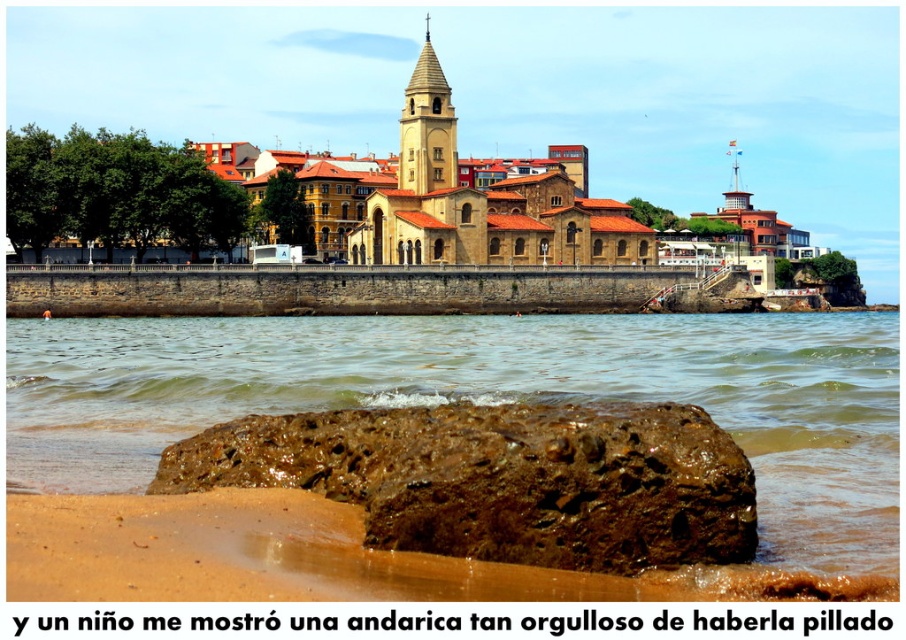
Who is positioned more to the right, brown wet sand at lower center or smooth stone tower at upper center?

smooth stone tower at upper center

Who is more forward, (92, 362) or (454, 131)?

Positioned in front is point (92, 362).

Measure the distance between point (x=661, y=346) and camera.

Point (x=661, y=346) is 95.59 meters away from camera.

Where is `brown wet sand at lower center`? The width and height of the screenshot is (906, 640). brown wet sand at lower center is located at coordinates (487, 396).

Between point (78, 433) and point (709, 448), which one is positioned behind?

The point (78, 433) is more distant.

Which is above, brown wet sand at lower center or brown rough rock at lower center?

brown wet sand at lower center is higher up.

The width and height of the screenshot is (906, 640). Identify the location of brown wet sand at lower center. (487, 396).

Where is `brown wet sand at lower center`? The image size is (906, 640). brown wet sand at lower center is located at coordinates (487, 396).

Can you confirm if brown rough rock at lower center is positioned below smooth stone tower at upper center?

Correct, brown rough rock at lower center is located below smooth stone tower at upper center.

Is point (208, 433) in front of point (429, 140)?

Yes, point (208, 433) is closer to viewer.

Find the location of a particular element. brown rough rock at lower center is located at coordinates (502, 480).